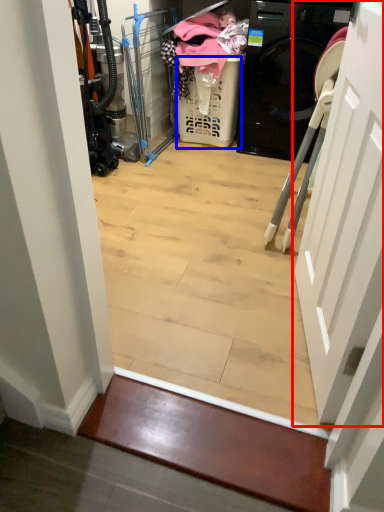
Question: Which point is further to the camera, door (highlighted by a red box) or basket (highlighted by a blue box)?

Choices:
 (A) door
 (B) basket

Answer: (B)